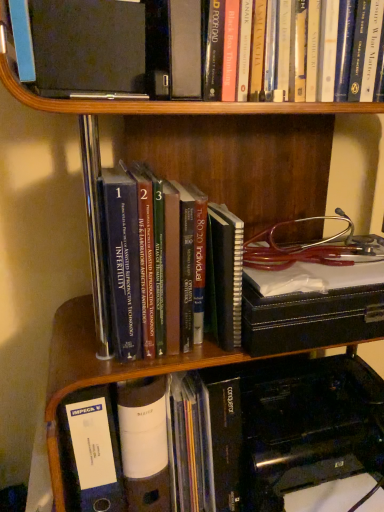
Question: From the image's perspective, would you say orange matte book at center, which is counted as the first book, starting from the bottom, is shown under blue hardcover books at center, the 2th book positioned from the bottom?

Choices:
 (A) yes
 (B) no

Answer: (A)

Question: Is orange matte book at center, which is counted as the first book, starting from the bottom, positioned behind blue hardcover books at center, the second book when ordered from top to bottom?

Choices:
 (A) no
 (B) yes

Answer: (B)

Question: Is orange matte book at center, which is counted as the first book, starting from the bottom, positioned far away from blue hardcover books at center, the 2th book positioned from the bottom?

Choices:
 (A) yes
 (B) no

Answer: (B)

Question: Would you say orange matte book at center, which is the third book in top-to-bottom order, contains blue hardcover books at center, the 2th book positioned from the bottom?

Choices:
 (A) no
 (B) yes

Answer: (A)

Question: Considering the relative sizes of orange matte book at center, which is counted as the first book, starting from the bottom, and blue hardcover books at center, the 2th book positioned from the bottom, in the image provided, is orange matte book at center, which is counted as the first book, starting from the bottom, taller than blue hardcover books at center, the 2th book positioned from the bottom,?

Choices:
 (A) no
 (B) yes

Answer: (A)

Question: Is orange matte book at center, which is the third book in top-to-bottom order, to the right of blue hardcover books at center, the 2th book positioned from the bottom, from the viewer's perspective?

Choices:
 (A) no
 (B) yes

Answer: (B)

Question: Can you confirm if blue hardcover books at center, the 2th book positioned from the bottom, is positioned to the right of orange matte book at center, which is the third book in top-to-bottom order?

Choices:
 (A) yes
 (B) no

Answer: (B)

Question: From the image's perspective, is blue hardcover books at center, the second book when ordered from top to bottom, under orange matte book at center, which is counted as the first book, starting from the bottom?

Choices:
 (A) no
 (B) yes

Answer: (A)

Question: Could you tell me if blue hardcover books at center, the second book when ordered from top to bottom, is turned towards orange matte book at center, which is counted as the first book, starting from the bottom?

Choices:
 (A) yes
 (B) no

Answer: (B)

Question: Considering the relative positions of blue hardcover books at center, the 2th book positioned from the bottom, and orange matte book at center, which is counted as the first book, starting from the bottom, in the image provided, is blue hardcover books at center, the 2th book positioned from the bottom, to the left of orange matte book at center, which is counted as the first book, starting from the bottom, from the viewer's perspective?

Choices:
 (A) yes
 (B) no

Answer: (A)

Question: Is blue hardcover books at center, the second book when ordered from top to bottom, behind orange matte book at center, which is the third book in top-to-bottom order?

Choices:
 (A) no
 (B) yes

Answer: (A)

Question: Can you confirm if blue hardcover books at center, the second book when ordered from top to bottom, is bigger than orange matte book at center, which is counted as the first book, starting from the bottom?

Choices:
 (A) no
 (B) yes

Answer: (B)

Question: Is hardcover book at upper center, which is the 3th book in bottom-to-top order, oriented towards orange matte book at center, which is counted as the first book, starting from the bottom?

Choices:
 (A) yes
 (B) no

Answer: (B)